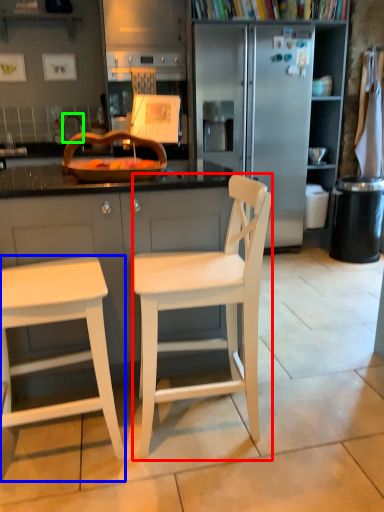
Question: Which object is positioned closest to chair (highlighted by a red box)? Select from stool (highlighted by a blue box) and faucet (highlighted by a green box).

Choices:
 (A) stool
 (B) faucet

Answer: (A)